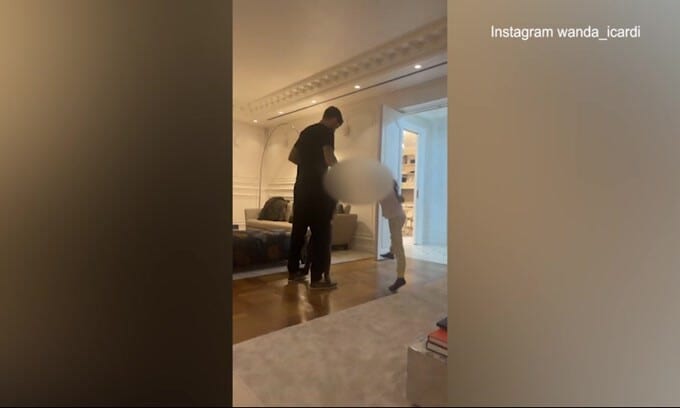
Where is `floor`? This screenshot has height=408, width=680. floor is located at coordinates (294, 311).